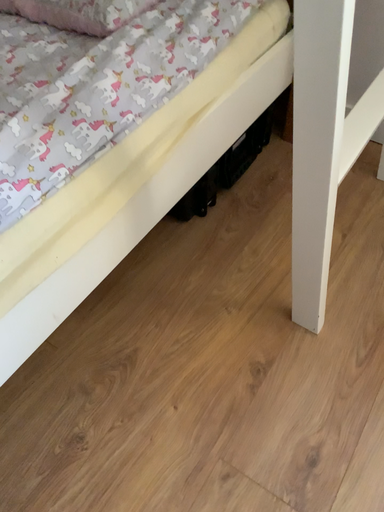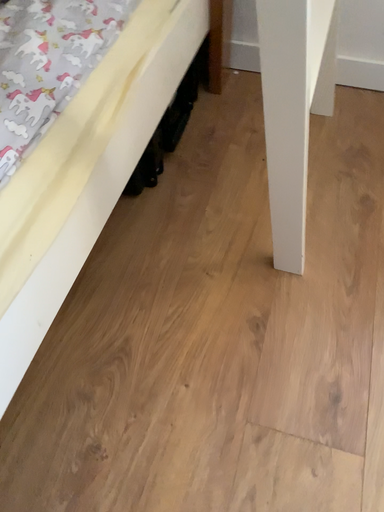
Question: How did the camera likely rotate when shooting the video?

Choices:
 (A) rotated right
 (B) rotated left

Answer: (A)